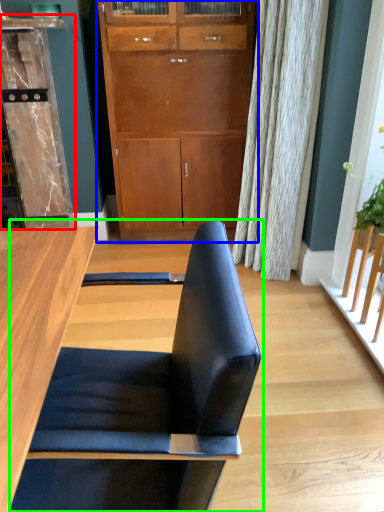
Question: Estimate the real-world distances between objects in this image. Which object is farther from dresser (highlighted by a red box), cabinetry (highlighted by a blue box) or chair (highlighted by a green box)?

Choices:
 (A) cabinetry
 (B) chair

Answer: (B)